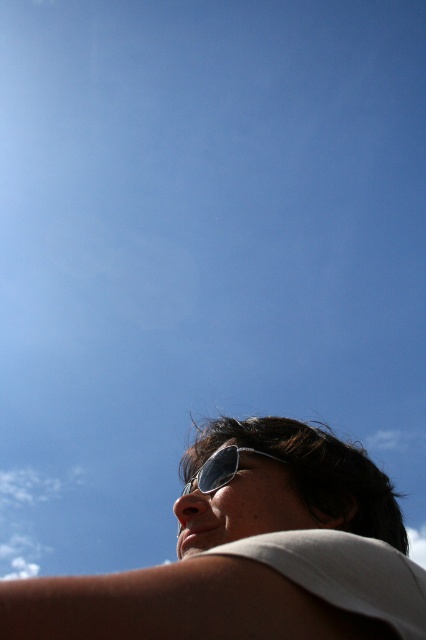
Question: Can you confirm if white fluffy cloud at upper left is positioned to the left of metallic reflective sunglasses at lower center?

Choices:
 (A) yes
 (B) no

Answer: (A)

Question: Is white matte sunglasses at upper center positioned at the back of metallic reflective sunglasses at lower center?

Choices:
 (A) no
 (B) yes

Answer: (A)

Question: Estimate the real-world distances between objects in this image. Which object is closer to the metallic reflective sunglasses at lower center?

Choices:
 (A) white fluffy cloud at upper left
 (B) white matte sunglasses at upper center

Answer: (B)

Question: Among these objects, which one is nearest to the camera?

Choices:
 (A) white fluffy cloud at upper left
 (B) metallic reflective sunglasses at lower center

Answer: (B)

Question: Which point is closer to the camera?

Choices:
 (A) pyautogui.click(x=28, y=556)
 (B) pyautogui.click(x=262, y=451)
 (C) pyautogui.click(x=209, y=616)

Answer: (C)

Question: Can you confirm if white fluffy cloud at upper left is bigger than metallic reflective sunglasses at lower center?

Choices:
 (A) yes
 (B) no

Answer: (A)